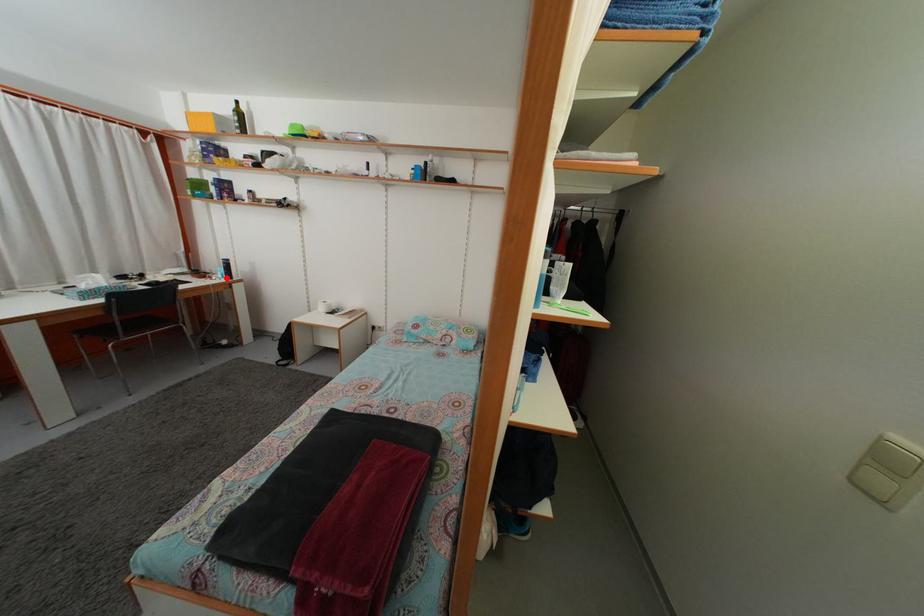
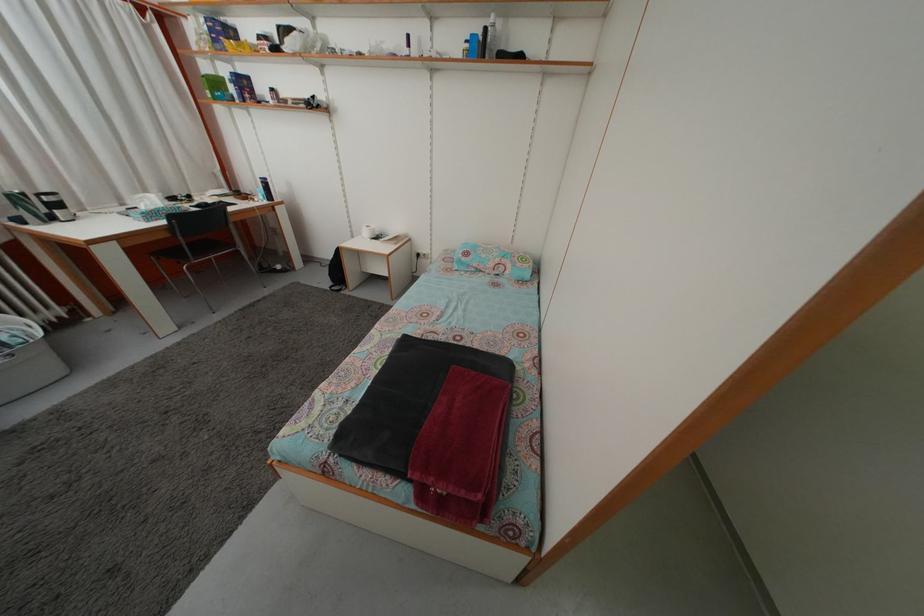
Find the pixel in the second image that matches the highlighted location in the first image.

(266, 199)